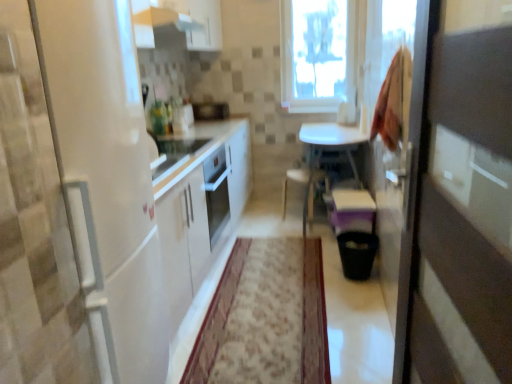
Question: Is satin black microwave at center spatially inside white glossy refrigerator at left, or outside of it?

Choices:
 (A) inside
 (B) outside

Answer: (B)

Question: From a real-world perspective, is satin black microwave at center physically located above or below white glossy refrigerator at left?

Choices:
 (A) below
 (B) above

Answer: (B)

Question: Which object is positioned farthest from the carpet with floral pattern at center?

Choices:
 (A) white glossy table at center
 (B) white glossy exhaust hood at upper center
 (C) white glossy refrigerator at left
 (D) satin black microwave at center
 (E) transparent glass window at upper center

Answer: (D)

Question: Which of these objects is positioned closest to the white glossy table at center?

Choices:
 (A) transparent glass window at upper center
 (B) carpet with floral pattern at center
 (C) white glossy exhaust hood at upper center
 (D) white glossy refrigerator at left
 (E) satin black microwave at center

Answer: (A)